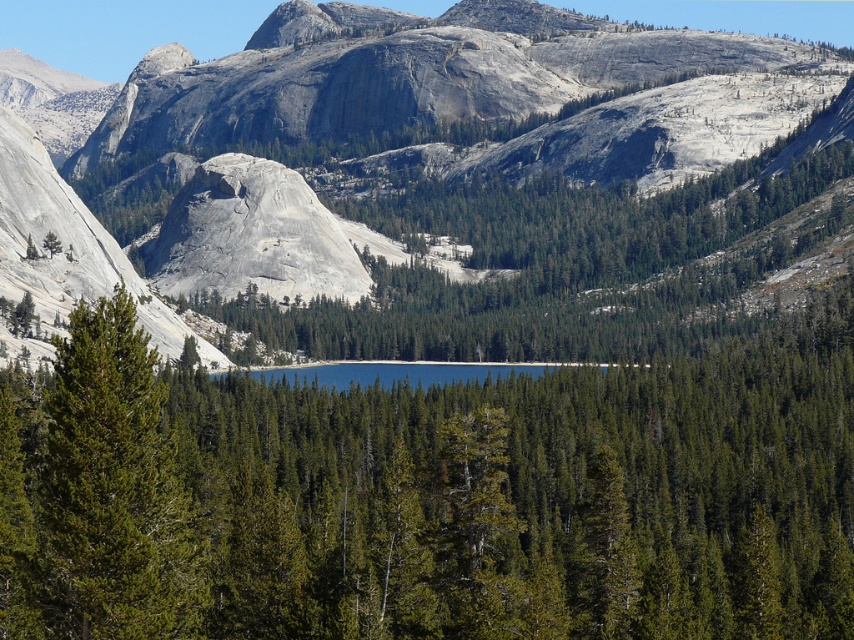
Does matte gray rock at center have a greater width compared to green matte tree at center?

Correct, the width of matte gray rock at center exceeds that of green matte tree at center.

Does matte gray rock at center appear under green matte tree at center?

Actually, matte gray rock at center is above green matte tree at center.

Is point (295, 4) closer to camera compared to point (250, 464)?

No, it is not.

Identify the location of matte gray rock at center. (442, 177).

Is green matte tree at center further to camera compared to green needle-like at left?

Yes, green matte tree at center is behind green needle-like at left.

In the scene shown: Can you confirm if green matte tree at center is positioned to the right of green needle-like at left?

Answer: Correct, you'll find green matte tree at center to the right of green needle-like at left.

Which is in front, point (398, 531) or point (103, 380)?

Point (103, 380) is more forward.

Image resolution: width=854 pixels, height=640 pixels. I want to click on green matte tree at center, so click(x=434, y=497).

Which is in front, point (44, 305) or point (114, 552)?

Positioned in front is point (114, 552).

Who is shorter, matte gray rock at center or green needle-like at left?

green needle-like at left

Does point (194, 275) lie behind point (16, 600)?

Yes, it is behind point (16, 600).

I want to click on matte gray rock at center, so click(x=442, y=177).